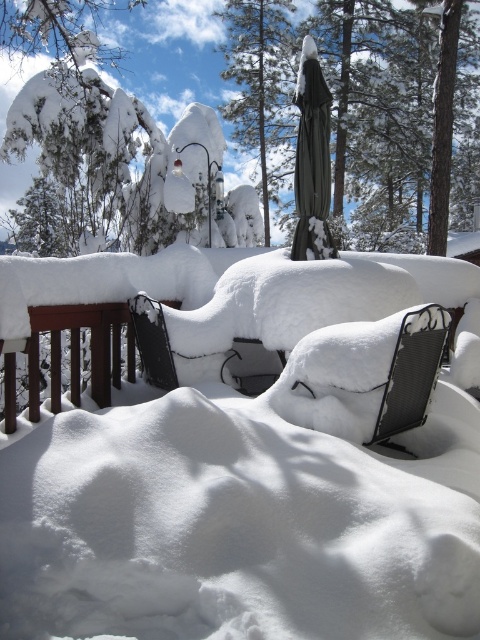
Does white snow-covered tree at upper left have a greater height compared to black mesh chair at center?

Yes.

Looking at this image, is white snow-covered tree at upper left wider than black mesh chair at center?

Indeed, white snow-covered tree at upper left has a greater width compared to black mesh chair at center.

You are a GUI agent. You are given a task and a screenshot of the screen. Output one action in this format:
    pyautogui.click(x=<x>, y=<y>)
    Task: Click on the white snow-covered tree at upper left
    The height and width of the screenshot is (640, 480).
    Given the screenshot: What is the action you would take?
    pyautogui.click(x=168, y=52)

Locate an element on the screen. white snow-covered tree at upper left is located at coordinates (168, 52).

Can you confirm if snow-covered tree at center is positioned to the right of black mesh chair at center?

Indeed, snow-covered tree at center is positioned on the right side of black mesh chair at center.

Between snow-covered tree at center and black mesh chair at center, which one appears on the right side from the viewer's perspective?

From the viewer's perspective, snow-covered tree at center appears more on the right side.

Who is more distant from viewer, (x=291, y=90) or (x=250, y=355)?

Point (x=291, y=90)

Identify the location of snow-covered tree at center. Image resolution: width=480 pixels, height=640 pixels. (261, 84).

Which is behind, point (397, 332) or point (194, 81)?

The point (194, 81) is behind.

Between point (326, 410) and point (301, 3), which one is positioned in front?

Point (326, 410)

Which is behind, point (328, 342) or point (190, 19)?

Positioned behind is point (190, 19).

Locate an element on the screen. Image resolution: width=480 pixels, height=640 pixels. white mesh folding chair at center is located at coordinates pyautogui.click(x=363, y=376).